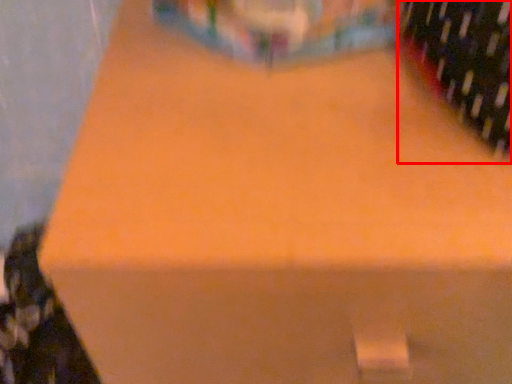
Question: Observing the image, what is the correct spatial positioning of wine bottle (annotated by the red box) in reference to wine bottle?

Choices:
 (A) right
 (B) left

Answer: (A)